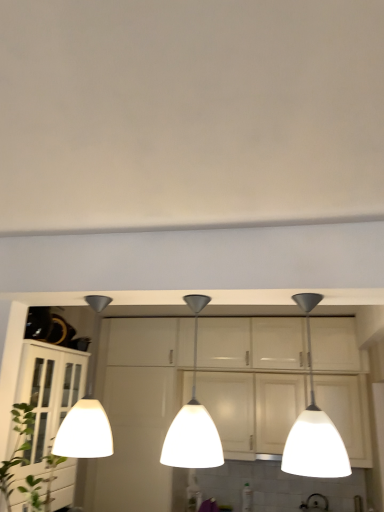
How much space does white glossy lampshade at right, positioned as the 3th lamp in left-to-right order, occupy horizontally?

The width of white glossy lampshade at right, positioned as the 3th lamp in left-to-right order, is 9.00 inches.

The width and height of the screenshot is (384, 512). What are the coordinates of `green leafy plant at lower left` in the screenshot? It's located at (17, 447).

What do you see at coordinates (193, 421) in the screenshot? The image size is (384, 512). I see `white glass pendant light at center, which ranks as the second lamp in left-to-right order` at bounding box center [193, 421].

You are a GUI agent. You are given a task and a screenshot of the screen. Output one action in this format:
    pyautogui.click(x=<x>, y=<y>)
    Task: Click on the white glossy pendant light at left, arranged as the third lamp when viewed from the right
    The image size is (384, 512).
    Given the screenshot: What is the action you would take?
    pyautogui.click(x=87, y=408)

Considering the relative sizes of white glossy cabinet at left and white glass pendant light at center, which ranks as the second lamp in right-to-left order, in the image provided, is white glossy cabinet at left thinner than white glass pendant light at center, which ranks as the second lamp in right-to-left order,?

No, white glossy cabinet at left is not thinner than white glass pendant light at center, which ranks as the second lamp in right-to-left order.

In the scene shown: Which is farther from the camera, [40,432] or [196,437]?

The point [40,432] is farther.

Which is more to the right, white glossy cabinet at left or white glass pendant light at center, which ranks as the second lamp in left-to-right order?

white glass pendant light at center, which ranks as the second lamp in left-to-right order, is more to the right.

Is white glossy cabinet at left turned away from white glass pendant light at center, which ranks as the second lamp in right-to-left order?

No, white glossy cabinet at left is not facing away from white glass pendant light at center, which ranks as the second lamp in right-to-left order.

Identify the location of plant below the white glossy lampshade at right, which appears as the first lamp when viewed from the right (from the image's perspective). (17, 447).

Between white glossy lampshade at right, positioned as the 3th lamp in left-to-right order, and green leafy plant at lower left, which one has more height?

With more height is white glossy lampshade at right, positioned as the 3th lamp in left-to-right order.

Based on the photo, could you tell me if white glossy lampshade at right, positioned as the 3th lamp in left-to-right order, is facing green leafy plant at lower left?

No, white glossy lampshade at right, positioned as the 3th lamp in left-to-right order, is not aimed at green leafy plant at lower left.

Which is in front, point (315, 426) or point (21, 487)?

The point (315, 426) is more forward.

Considering the sizes of white glossy pendant light at left, which is the first lamp in left-to-right order, and white glossy lampshade at right, positioned as the 3th lamp in left-to-right order, in the image, is white glossy pendant light at left, which is the first lamp in left-to-right order, bigger or smaller than white glossy lampshade at right, positioned as the 3th lamp in left-to-right order,?

white glossy pendant light at left, which is the first lamp in left-to-right order, is bigger than white glossy lampshade at right, positioned as the 3th lamp in left-to-right order.

From the image's perspective, which object appears higher, white glossy pendant light at left, which is the first lamp in left-to-right order, or white glossy lampshade at right, positioned as the 3th lamp in left-to-right order?

From the image's view, white glossy lampshade at right, positioned as the 3th lamp in left-to-right order, is above.

Does point (103, 411) appear closer or farther from the camera than point (323, 450)?

Point (103, 411) is farther from the camera than point (323, 450).

Is white glossy pendant light at left, arranged as the third lamp when viewed from the right, shorter than white glossy lampshade at right, positioned as the 3th lamp in left-to-right order?

No.

Is white glass pendant light at center, which ranks as the second lamp in right-to-left order, closer to camera compared to white glossy lampshade at right, which appears as the first lamp when viewed from the right?

No, white glass pendant light at center, which ranks as the second lamp in right-to-left order, is further to the viewer.

From the picture: From the image's perspective, relative to white glossy lampshade at right, positioned as the 3th lamp in left-to-right order, is white glass pendant light at center, which ranks as the second lamp in right-to-left order, above or below?

From the image's perspective, white glass pendant light at center, which ranks as the second lamp in right-to-left order, appears below white glossy lampshade at right, positioned as the 3th lamp in left-to-right order.

Based on their sizes in the image, would you say white glass pendant light at center, which ranks as the second lamp in left-to-right order, is bigger or smaller than white glossy lampshade at right, which appears as the first lamp when viewed from the right?

In the image, white glass pendant light at center, which ranks as the second lamp in left-to-right order, appears to be smaller than white glossy lampshade at right, which appears as the first lamp when viewed from the right.

Is white glass pendant light at center, which ranks as the second lamp in right-to-left order, aimed at white glossy lampshade at right, positioned as the 3th lamp in left-to-right order?

No.

Is green leafy plant at lower left directly adjacent to white glossy pendant light at left, arranged as the third lamp when viewed from the right?

No, green leafy plant at lower left is not next to white glossy pendant light at left, arranged as the third lamp when viewed from the right.

Is green leafy plant at lower left aimed at white glossy pendant light at left, arranged as the third lamp when viewed from the right?

→ No, green leafy plant at lower left is not aimed at white glossy pendant light at left, arranged as the third lamp when viewed from the right.

Does green leafy plant at lower left have a greater width compared to white glossy pendant light at left, arranged as the third lamp when viewed from the right?

Indeed, green leafy plant at lower left has a greater width compared to white glossy pendant light at left, arranged as the third lamp when viewed from the right.

Does green leafy plant at lower left appear on the right side of white glossy pendant light at left, arranged as the third lamp when viewed from the right?

Incorrect, green leafy plant at lower left is not on the right side of white glossy pendant light at left, arranged as the third lamp when viewed from the right.

Can you confirm if white glossy cabinet at left is bigger than green leafy plant at lower left?

Yes, white glossy cabinet at left is bigger than green leafy plant at lower left.

Consider the image. Would you say white glossy cabinet at left is inside or outside green leafy plant at lower left?

white glossy cabinet at left is not inside green leafy plant at lower left, it's outside.

Which of these two, white glossy cabinet at left or white glossy lampshade at right, positioned as the 3th lamp in left-to-right order, stands taller?

white glossy cabinet at left.

Is white glossy cabinet at left positioned before white glossy lampshade at right, which appears as the first lamp when viewed from the right?

No, white glossy cabinet at left is further to the viewer.

From the white glossy cabinet at left, count 3rd lamp to the right and point to it. Please provide its 2D coordinates.

[(314, 426)]

Does point (56, 503) appear closer or farther from the camera than point (343, 463)?

Point (56, 503).

Locate an element on the screen. cabinetry behind the white glass pendant light at center, which ranks as the second lamp in right-to-left order is located at coordinates (46, 400).

Find the location of a particular element. This screenshot has height=512, width=384. plant below the white glossy lampshade at right, which appears as the first lamp when viewed from the right (from the image's perspective) is located at coordinates (17, 447).

When comparing their distances from white glass pendant light at center, which ranks as the second lamp in right-to-left order, does green leafy plant at lower left or white glossy pendant light at left, arranged as the third lamp when viewed from the right, seem further?

white glossy pendant light at left, arranged as the third lamp when viewed from the right, is positioned further to the anchor white glass pendant light at center, which ranks as the second lamp in right-to-left order.

Considering their positions, is white glossy cabinet at left positioned further to white glass pendant light at center, which ranks as the second lamp in left-to-right order, than white glossy lampshade at right, positioned as the 3th lamp in left-to-right order?

white glossy cabinet at left is positioned further to the anchor white glass pendant light at center, which ranks as the second lamp in left-to-right order.

Considering their positions, is white glossy cabinet at left positioned closer to white glossy lampshade at right, positioned as the 3th lamp in left-to-right order, than green leafy plant at lower left?

The object closer to white glossy lampshade at right, positioned as the 3th lamp in left-to-right order, is green leafy plant at lower left.

When comparing their distances from white glossy pendant light at left, which is the first lamp in left-to-right order, does green leafy plant at lower left or white glossy cabinet at left seem closer?

white glossy cabinet at left is positioned closer to the anchor white glossy pendant light at left, which is the first lamp in left-to-right order.

Looking at the image, which one is located closer to green leafy plant at lower left, white glossy pendant light at left, which is the first lamp in left-to-right order, or white glossy lampshade at right, positioned as the 3th lamp in left-to-right order?

white glossy lampshade at right, positioned as the 3th lamp in left-to-right order.

Considering their positions, is white glass pendant light at center, which ranks as the second lamp in right-to-left order, positioned further to green leafy plant at lower left than white glossy pendant light at left, which is the first lamp in left-to-right order?

white glossy pendant light at left, which is the first lamp in left-to-right order, is positioned further to the anchor green leafy plant at lower left.

Estimate the real-world distances between objects in this image. Which object is closer to green leafy plant at lower left, white glossy cabinet at left or white glossy lampshade at right, positioned as the 3th lamp in left-to-right order?

white glossy cabinet at left is closer to green leafy plant at lower left.

Based on their spatial positions, is green leafy plant at lower left or white glass pendant light at center, which ranks as the second lamp in left-to-right order, further from white glossy pendant light at left, arranged as the third lamp when viewed from the right?

white glass pendant light at center, which ranks as the second lamp in left-to-right order.

At what (x,y) coordinates should I click in order to perform the action: click on lamp between white glossy pendant light at left, which is the first lamp in left-to-right order, and white glossy lampshade at right, positioned as the 3th lamp in left-to-right order. Please return your answer as a coordinate pair (x, y). Looking at the image, I should click on (193, 421).

I want to click on plant between white glossy cabinet at left and white glass pendant light at center, which ranks as the second lamp in right-to-left order, so click(17, 447).

The image size is (384, 512). Find the location of `lamp located between green leafy plant at lower left and white glass pendant light at center, which ranks as the second lamp in left-to-right order, in the left-right direction`. lamp located between green leafy plant at lower left and white glass pendant light at center, which ranks as the second lamp in left-to-right order, in the left-right direction is located at coordinates [87, 408].

The width and height of the screenshot is (384, 512). What are the coordinates of `plant located between white glossy cabinet at left and white glossy pendant light at left, arranged as the third lamp when viewed from the right, in the left-right direction` in the screenshot? It's located at (17, 447).